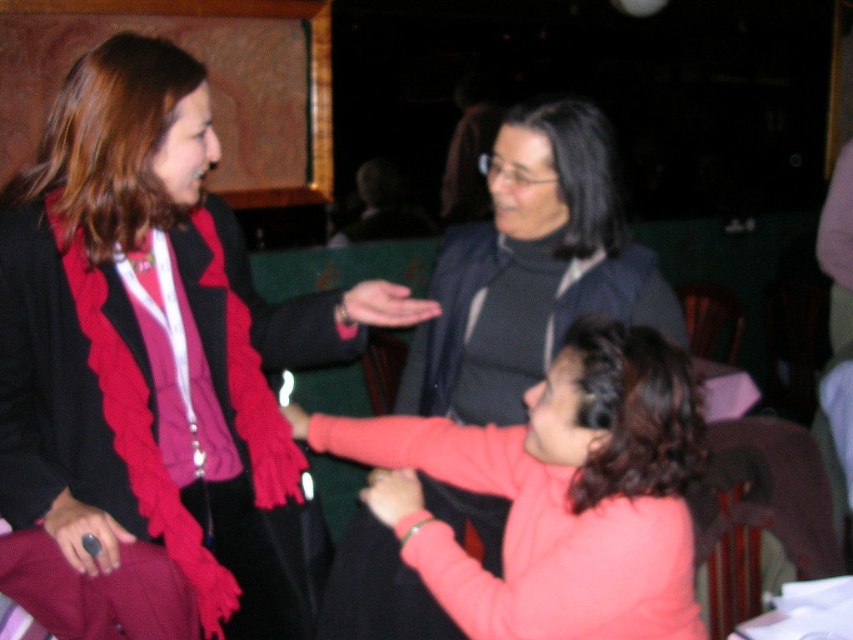
You are taking a photo of two points in the image. The first point is at coordinate point [567,445] and the second is at point [376,504]. Which point will appear larger in your photo?

Point [567,445] is closer to the camera than point [376,504], so it will appear larger in the photo.